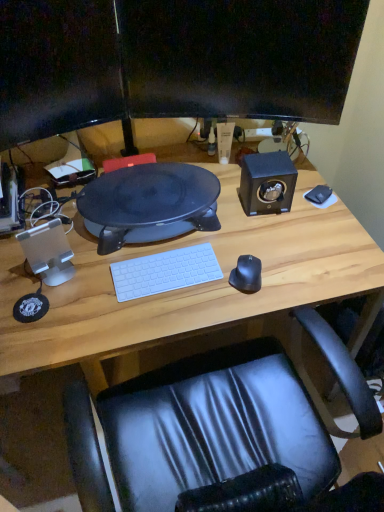
At what (x,y) coordinates should I click in order to perform the action: click on empty space that is to the right of black plastic computer at center. Please return your answer as a coordinate pair (x, y). The width and height of the screenshot is (384, 512). Looking at the image, I should click on 267,230.